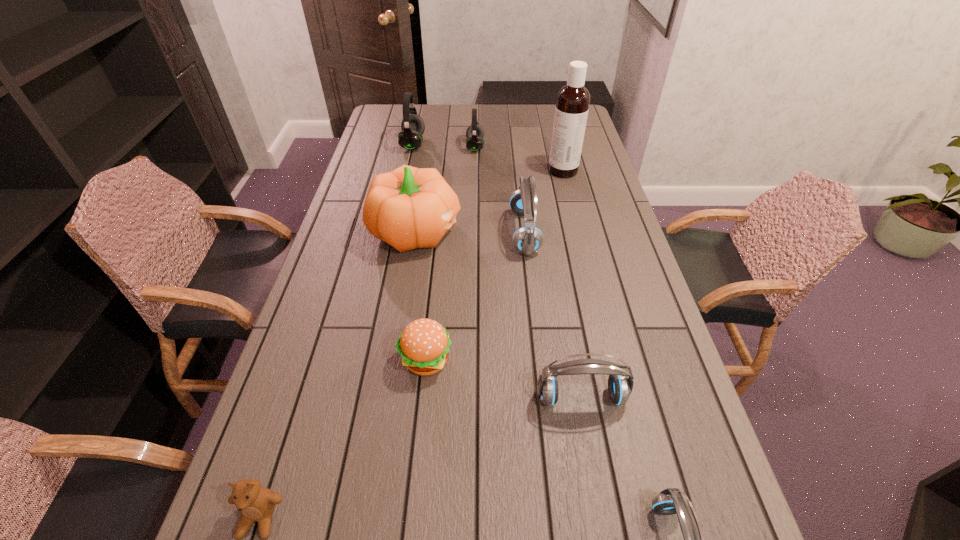
The height and width of the screenshot is (540, 960). Find the location of `dishwasher detergent`. dishwasher detergent is located at coordinates (572, 105).

The width and height of the screenshot is (960, 540). I want to click on the tallest object, so click(572, 105).

At what (x,y) coordinates should I click in order to perform the action: click on pumpkin. Please return your answer as a coordinate pair (x, y). This screenshot has width=960, height=540. Looking at the image, I should click on (408, 208).

Identify the location of the bigger black headset. (410, 138).

Locate an element on the screen. Image resolution: width=960 pixels, height=540 pixels. the left black headset is located at coordinates (410, 138).

In order to click on the biggest blue headset in this screenshot , I will do (527, 239).

The height and width of the screenshot is (540, 960). What are the coordinates of `the farthest blue headset` in the screenshot? It's located at point(527,239).

At what (x,y) coordinates should I click in order to perform the action: click on the fifth object from left to right. Please return your answer as a coordinate pair (x, y). Looking at the image, I should click on (474, 133).

Where is `the right black headset`? the right black headset is located at coordinates (474, 133).

Locate an element on the screen. Image resolution: width=960 pixels, height=540 pixels. the second biggest blue headset is located at coordinates (620, 387).